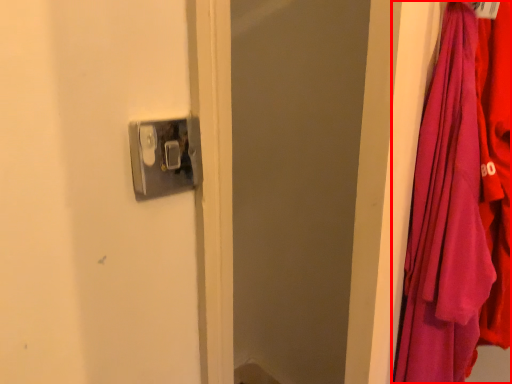
Question: Observing the image, what is the correct spatial positioning of curtain (annotated by the red box) in reference to door handle?

Choices:
 (A) left
 (B) right

Answer: (B)